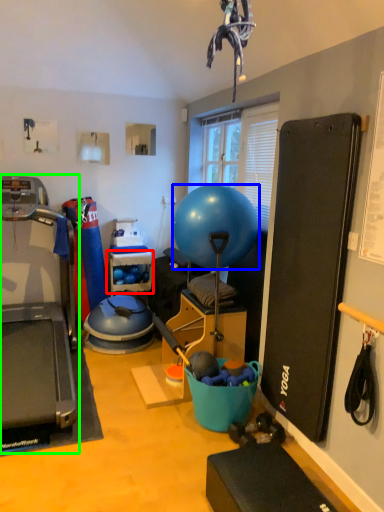
Question: Considering the real-world distances, which object is closest to shelf (highlighted by a red box)? ball (highlighted by a blue box) or treadmill (highlighted by a green box).

Choices:
 (A) ball
 (B) treadmill

Answer: (B)